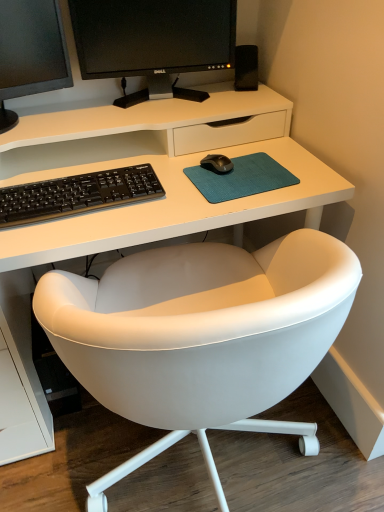
Question: Is black glossy monitor at upper center, arranged as the 2th computer monitor when viewed from the left, located outside black glossy monitor at upper left, the first computer monitor in the left-to-right sequence?

Choices:
 (A) yes
 (B) no

Answer: (A)

Question: Is black glossy monitor at upper center, marked as the 1th computer monitor in a right-to-left arrangement, to the left of black glossy monitor at upper left, which is counted as the second computer monitor, starting from the right, from the viewer's perspective?

Choices:
 (A) yes
 (B) no

Answer: (B)

Question: Can you confirm if black glossy monitor at upper center, arranged as the 2th computer monitor when viewed from the left, is taller than black glossy monitor at upper left, which is counted as the second computer monitor, starting from the right?

Choices:
 (A) no
 (B) yes

Answer: (A)

Question: Can you see black glossy monitor at upper center, marked as the 1th computer monitor in a right-to-left arrangement, touching black glossy monitor at upper left, the first computer monitor in the left-to-right sequence?

Choices:
 (A) yes
 (B) no

Answer: (B)

Question: Can you confirm if black glossy monitor at upper center, marked as the 1th computer monitor in a right-to-left arrangement, is bigger than black glossy monitor at upper left, which is counted as the second computer monitor, starting from the right?

Choices:
 (A) no
 (B) yes

Answer: (A)

Question: Is black matte speaker at upper right taller or shorter than black glossy monitor at upper center, marked as the 1th computer monitor in a right-to-left arrangement?

Choices:
 (A) short
 (B) tall

Answer: (A)

Question: Is black matte speaker at upper right to the left or to the right of black glossy monitor at upper center, marked as the 1th computer monitor in a right-to-left arrangement, in the image?

Choices:
 (A) right
 (B) left

Answer: (A)

Question: Choose the correct answer: Is black matte speaker at upper right inside black glossy monitor at upper center, arranged as the 2th computer monitor when viewed from the left, or outside it?

Choices:
 (A) inside
 (B) outside

Answer: (B)

Question: From a real-world perspective, is black matte speaker at upper right physically located above or below black glossy monitor at upper center, marked as the 1th computer monitor in a right-to-left arrangement?

Choices:
 (A) below
 (B) above

Answer: (A)

Question: Is black glossy monitor at upper center, marked as the 1th computer monitor in a right-to-left arrangement, spatially inside black matte keyboard at center, or outside of it?

Choices:
 (A) outside
 (B) inside

Answer: (A)

Question: Relative to black matte keyboard at center, is black glossy monitor at upper center, marked as the 1th computer monitor in a right-to-left arrangement, in front or behind?

Choices:
 (A) front
 (B) behind

Answer: (B)

Question: Would you say black glossy monitor at upper center, marked as the 1th computer monitor in a right-to-left arrangement, is to the left or to the right of black matte keyboard at center in the picture?

Choices:
 (A) right
 (B) left

Answer: (A)

Question: In terms of size, does black glossy monitor at upper center, marked as the 1th computer monitor in a right-to-left arrangement, appear bigger or smaller than black matte keyboard at center?

Choices:
 (A) small
 (B) big

Answer: (B)

Question: Considering their positions, is black matte speaker at upper right located in front of or behind black glossy monitor at upper left, which is counted as the second computer monitor, starting from the right?

Choices:
 (A) behind
 (B) front

Answer: (A)

Question: Would you say black matte speaker at upper right is inside or outside black glossy monitor at upper left, the first computer monitor in the left-to-right sequence?

Choices:
 (A) inside
 (B) outside

Answer: (B)